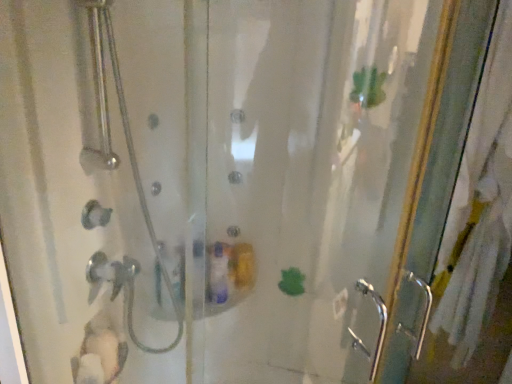
Question: Is clear glass shower door at left bigger or smaller than clear glass screen door at right?

Choices:
 (A) big
 (B) small

Answer: (B)

Question: From a real-world perspective, is clear glass shower door at left above or below clear glass screen door at right?

Choices:
 (A) above
 (B) below

Answer: (A)

Question: Is clear glass shower door at left spatially inside clear glass screen door at right, or outside of it?

Choices:
 (A) inside
 (B) outside

Answer: (B)

Question: In the image, is clear glass screen door at right on the left side or the right side of clear glass shower door at left?

Choices:
 (A) left
 (B) right

Answer: (B)

Question: Considering the positions of clear glass screen door at right and clear glass shower door at left in the image, is clear glass screen door at right bigger or smaller than clear glass shower door at left?

Choices:
 (A) big
 (B) small

Answer: (A)

Question: From the image's perspective, is clear glass screen door at right above or below clear glass shower door at left?

Choices:
 (A) below
 (B) above

Answer: (A)

Question: Is clear glass screen door at right wider or thinner than clear glass shower door at left?

Choices:
 (A) wide
 (B) thin

Answer: (A)